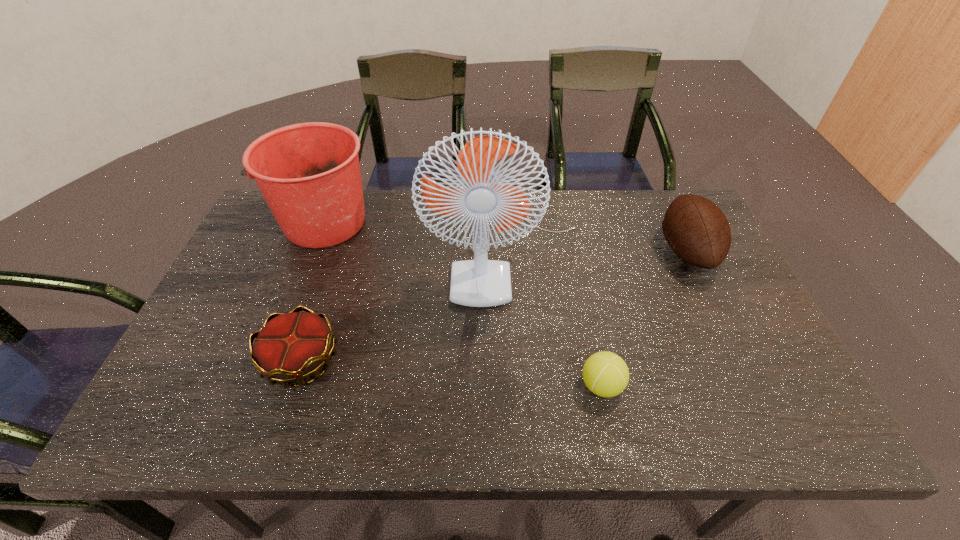
Find the location of a particular element. fan is located at coordinates (480, 282).

Find the location of `the fourth shortest object`. the fourth shortest object is located at coordinates (309, 174).

You are a GUI agent. You are given a task and a screenshot of the screen. Output one action in this format:
    pyautogui.click(x=<x>, y=<y>)
    Task: Click on the football
    This screenshot has height=540, width=960.
    Given the screenshot: What is the action you would take?
    pyautogui.click(x=698, y=232)

Where is `the rightmost object`? The height and width of the screenshot is (540, 960). the rightmost object is located at coordinates (698, 232).

Where is `crown`? The image size is (960, 540). crown is located at coordinates (290, 347).

Locate an element on the screen. The image size is (960, 540). tennis ball is located at coordinates (605, 374).

I want to click on vacant region located 0.270m on the front-facing side of the fan, so click(516, 404).

I want to click on vacant space located 0.270m on the front of the bucket, so pos(281,332).

Image resolution: width=960 pixels, height=540 pixels. I want to click on vacant space located on the laces of the third shortest object, so click(560, 251).

Where is `free space located 0.070m on the laces of the third shortest object`? The width and height of the screenshot is (960, 540). free space located 0.070m on the laces of the third shortest object is located at coordinates (635, 251).